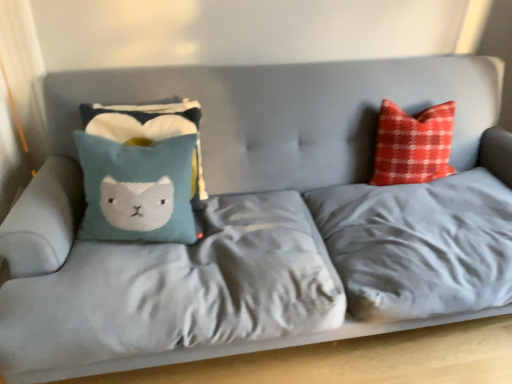
What do you see at coordinates (141, 121) in the screenshot? The height and width of the screenshot is (384, 512). I see `blue fabric pillow with cat design at left` at bounding box center [141, 121].

Where is `blue fabric pillow with cat design at left`? This screenshot has width=512, height=384. blue fabric pillow with cat design at left is located at coordinates (141, 121).

Where is `blue fabric pillow with cat design at left`? The height and width of the screenshot is (384, 512). blue fabric pillow with cat design at left is located at coordinates (141, 121).